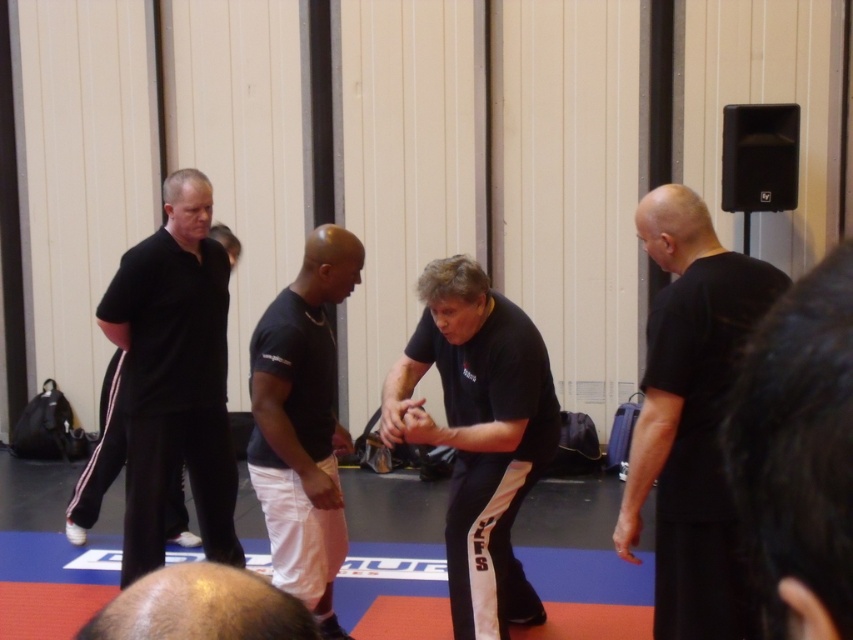
You are a photographer standing at the entrance of the gymnasium. You want to take a photo of the black matte shirt at right and the man in the dark blue t shirt and white shorts. How far apart are they in feet?

The black matte shirt at right and the man in the dark blue t shirt and white shorts are 7.88 feet apart.

You are standing at the center of the gymnasium and want to approach the black matte shirt at right. According to the coordinates provided, in which direction should you move to reach it?

The black matte shirt at right is located at coordinates point (x=691, y=419). Since the x and y coordinates are both above 0.5, you should move towards the upper right direction from the center to reach it.